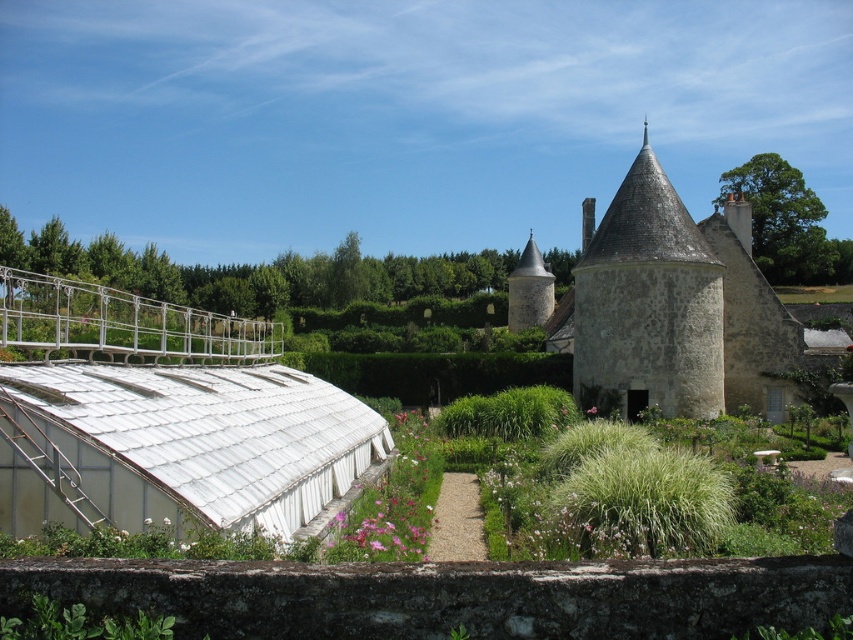
You are standing at the center of the garden and want to locate the stone textured tower at upper right. According to the coordinates provided, in which direction should you look to find it?

The stone textured tower at upper right is located at coordinates point (648, 301), which is to the upper right direction from your current position at the center of the garden.

You are standing in the garden and want to walk towards both the stone tower at center and the stone textured tower at upper right. Which tower will you reach first?

You will reach the stone tower at center first because it is closer to you than the stone textured tower at upper right, which is further away.